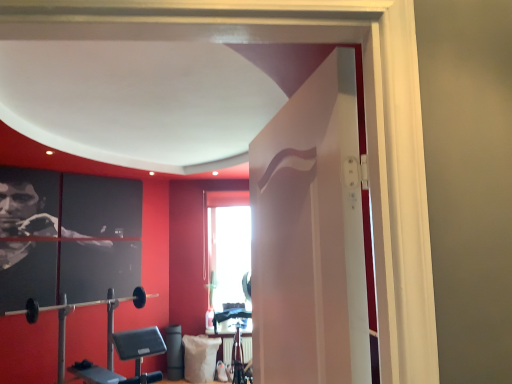
The width and height of the screenshot is (512, 384). I want to click on white glossy door at center, so click(309, 227).

You are a GUI agent. You are given a task and a screenshot of the screen. Output one action in this format:
    pyautogui.click(x=<x>, y=<y>)
    Task: Click on the door on the right of the black rubber barbell at lower left
    This screenshot has height=384, width=512.
    Given the screenshot: What is the action you would take?
    pyautogui.click(x=309, y=227)

Is white glossy door at center taller or shorter than black rubber barbell at lower left?

Clearly, white glossy door at center is taller compared to black rubber barbell at lower left.

Is white glossy door at center with black rubber barbell at lower left?

No.

Is white glossy door at center to the left of black rubber barbell at lower left from the viewer's perspective?

In fact, white glossy door at center is to the right of black rubber barbell at lower left.

How distant is white glossy door at center from white fabric pillow at lower center?

A distance of 10.75 feet exists between white glossy door at center and white fabric pillow at lower center.

Is white glossy door at center oriented away from white fabric pillow at lower center?

white glossy door at center does not have its back to white fabric pillow at lower center.

Is white glossy door at center at the right side of white fabric pillow at lower center?

Yes.

From a real-world perspective, who is located higher, white glossy door at center or white fabric pillow at lower center?

white glossy door at center.

Based on the photo, which of these two, black rubber barbell at lower left or white glossy door at center, stands taller?

Standing taller between the two is white glossy door at center.

Would you say black rubber barbell at lower left is to the left or to the right of white glossy door at center in the picture?

Based on their positions, black rubber barbell at lower left is located to the left of white glossy door at center.

Which is behind, black rubber barbell at lower left or white glossy door at center?

Positioned behind is black rubber barbell at lower left.

Measure the distance from white fabric pillow at lower center to white glossy door at center.

white fabric pillow at lower center is 3.28 meters from white glossy door at center.

Is white fabric pillow at lower center further to the viewer compared to white glossy door at center?

Yes, it is behind white glossy door at center.

Who is smaller, white fabric pillow at lower center or white glossy door at center?

white fabric pillow at lower center is smaller.

Does white fabric pillow at lower center turn towards white glossy door at center?

Yes.

Which object is positioned more to the right, black rubber barbell at lower left or white fabric pillow at lower center?

white fabric pillow at lower center.

Considering the relative sizes of black rubber barbell at lower left and white fabric pillow at lower center in the image provided, is black rubber barbell at lower left wider than white fabric pillow at lower center?

Incorrect, the width of black rubber barbell at lower left does not surpass that of white fabric pillow at lower center.

Is black rubber barbell at lower left not close to white fabric pillow at lower center?

That's right, there is a large distance between black rubber barbell at lower left and white fabric pillow at lower center.

Could you tell me if black rubber barbell at lower left is turned towards white fabric pillow at lower center?

No.

Considering the positions of point (199, 358) and point (33, 301), is point (199, 358) closer or farther from the camera than point (33, 301)?

Point (199, 358) is closer to the camera than point (33, 301).

Can you confirm if white fabric pillow at lower center is wider than black rubber barbell at lower left?

Yes, white fabric pillow at lower center is wider than black rubber barbell at lower left.

From the image's perspective, is white fabric pillow at lower center beneath black rubber barbell at lower left?

Yes, from the image's perspective, white fabric pillow at lower center is below black rubber barbell at lower left.

Find the location of a particular element. This screenshot has height=384, width=512. barbell above the white fabric pillow at lower center (from a real-world perspective) is located at coordinates (80, 304).

Find the location of a particular element. The height and width of the screenshot is (384, 512). door above the black rubber barbell at lower left (from the image's perspective) is located at coordinates (309, 227).

Image resolution: width=512 pixels, height=384 pixels. In order to click on pillow on the left of white glossy door at center in this screenshot , I will do `click(200, 358)`.

Looking at the image, which one is located closer to white glossy door at center, black rubber barbell at lower left or white fabric pillow at lower center?

white fabric pillow at lower center.

From the image, which object appears to be nearer to black rubber barbell at lower left, white fabric pillow at lower center or white glossy door at center?

white fabric pillow at lower center is positioned closer to the anchor black rubber barbell at lower left.

From the image, which object appears to be nearer to white fabric pillow at lower center, white glossy door at center or black rubber barbell at lower left?

Based on the image, black rubber barbell at lower left appears to be nearer to white fabric pillow at lower center.

Looking at the image, which one is located closer to white fabric pillow at lower center, black rubber barbell at lower left or white glossy door at center?

Based on the image, black rubber barbell at lower left appears to be nearer to white fabric pillow at lower center.

Considering their positions, is white fabric pillow at lower center positioned further to white glossy door at center than black rubber barbell at lower left?

black rubber barbell at lower left lies further to white glossy door at center than the other object.

From the image, which object appears to be nearer to black rubber barbell at lower left, white glossy door at center or white fabric pillow at lower center?

Based on the image, white fabric pillow at lower center appears to be nearer to black rubber barbell at lower left.

The height and width of the screenshot is (384, 512). In order to click on barbell between white glossy door at center and white fabric pillow at lower center along the z-axis in this screenshot , I will do `click(80, 304)`.